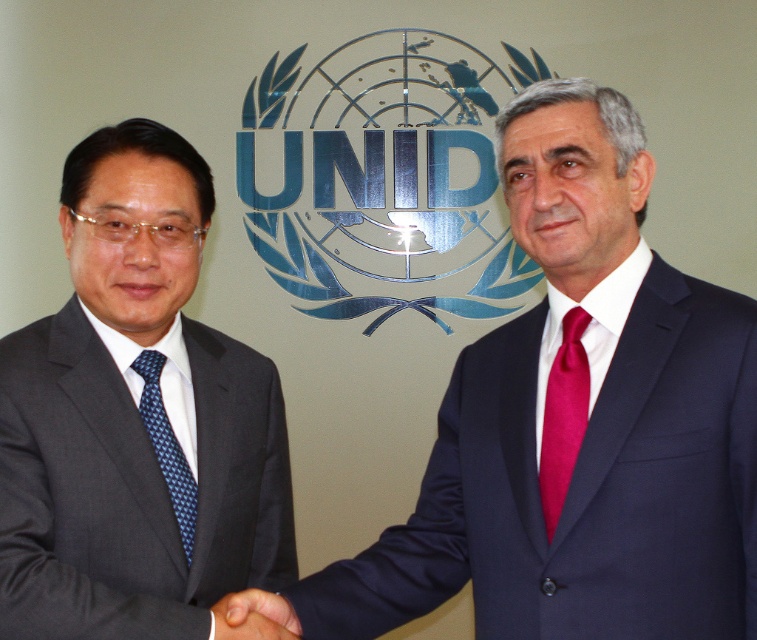
How distant is blue dotted tie at left from black matte hand at center?

blue dotted tie at left is 21.15 centimeters away from black matte hand at center.

Is point (148, 419) positioned in front of point (245, 605)?

No, it is not.

The image size is (757, 640). I want to click on blue dotted tie at left, so click(167, 445).

Between matte black suit at left and shiny red tie at right, which one appears on the left side from the viewer's perspective?

Result: matte black suit at left is more to the left.

Who is lower down, matte black suit at left or shiny red tie at right?

shiny red tie at right is lower down.

Is point (42, 464) more distant than point (565, 492)?

Yes, point (42, 464) is behind point (565, 492).

The image size is (757, 640). I want to click on matte black suit at left, so click(134, 419).

Can you confirm if navy blue suit at center is smaller than shiny red tie at right?

No.

Is navy blue suit at center to the left of shiny red tie at right from the viewer's perspective?

Correct, you'll find navy blue suit at center to the left of shiny red tie at right.

Which is in front, point (575, 614) or point (558, 465)?

Point (575, 614)

The height and width of the screenshot is (640, 757). What are the coordinates of `navy blue suit at center` in the screenshot? It's located at (586, 426).